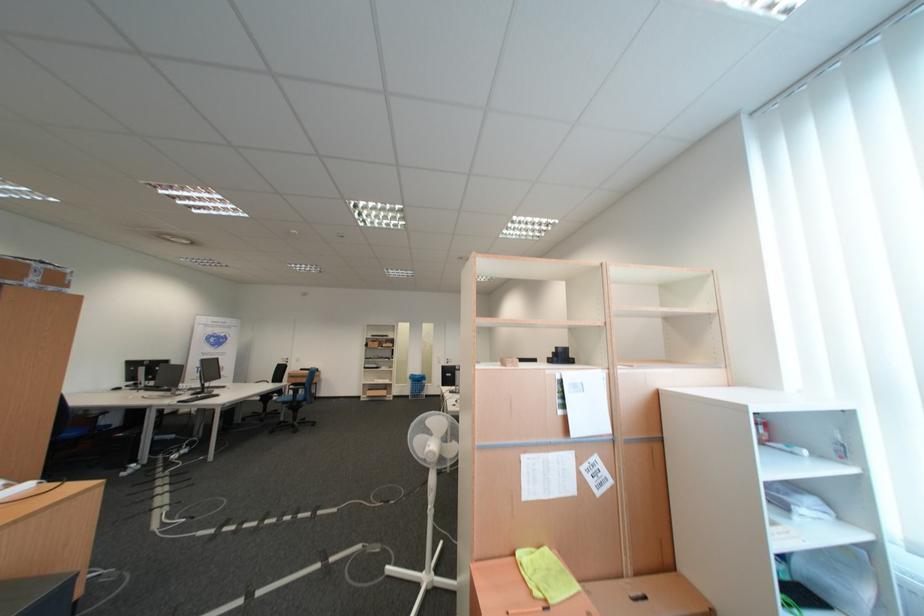
Image resolution: width=924 pixels, height=616 pixels. What do you see at coordinates (293, 387) in the screenshot? I see `the blue chair armrest` at bounding box center [293, 387].